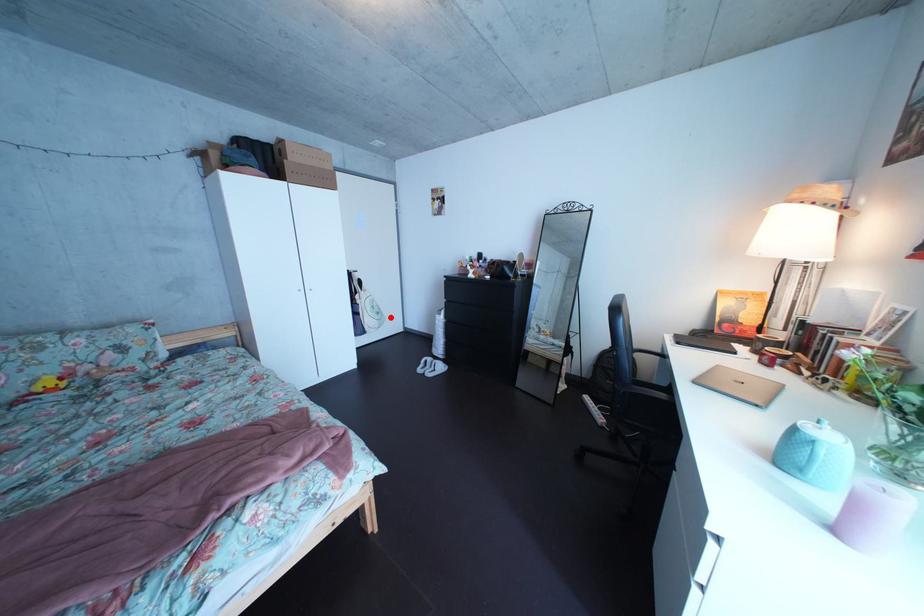
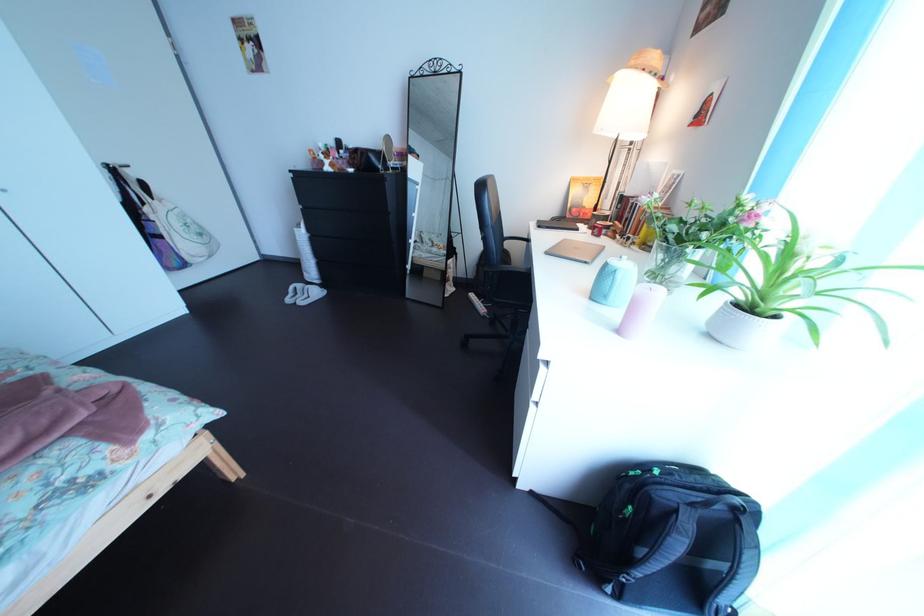
Question: I am providing you with two images of the same scene from different viewpoints. A red point is marked on the first image. At the location where the point appears in image 1, is it still visible in image 2?

Choices:
 (A) Yes
 (B) No

Answer: (A)